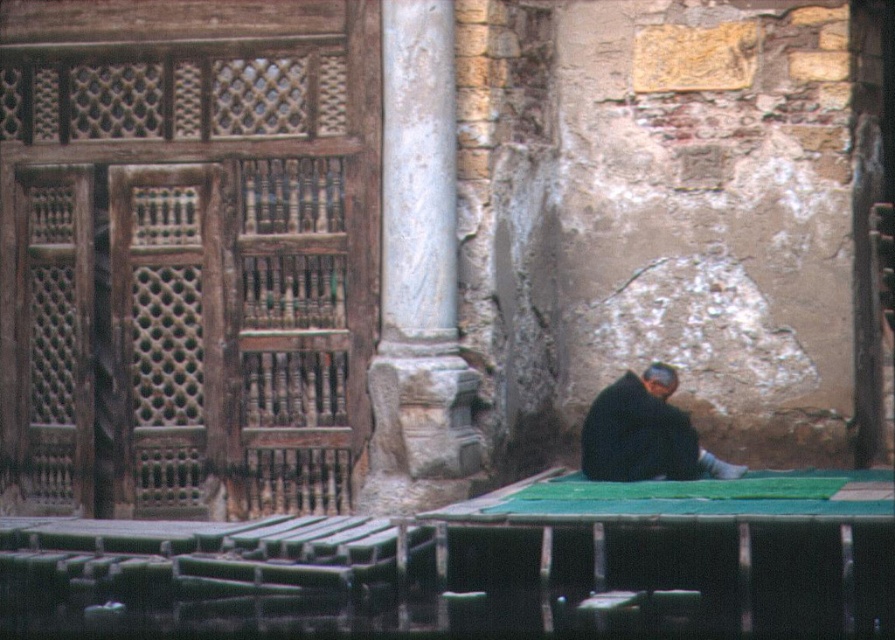
Question: Can you confirm if white marble column at center is wider than black matte jacket at lower right?

Choices:
 (A) yes
 (B) no

Answer: (B)

Question: Among these objects, which one is nearest to the camera?

Choices:
 (A) black matte jacket at lower right
 (B) white marble column at center

Answer: (A)

Question: Is white marble column at center to the left of black matte jacket at lower right from the viewer's perspective?

Choices:
 (A) yes
 (B) no

Answer: (A)

Question: Which of the following is the closest to the observer?

Choices:
 (A) (407, 362)
 (B) (606, 477)

Answer: (A)

Question: Observing the image, what is the correct spatial positioning of white marble column at center in reference to black matte jacket at lower right?

Choices:
 (A) right
 (B) left

Answer: (B)